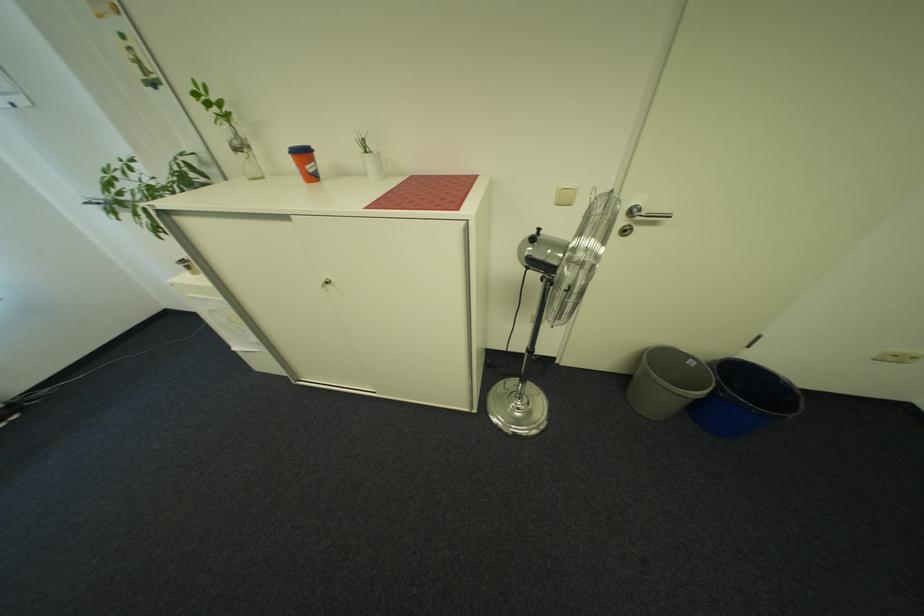
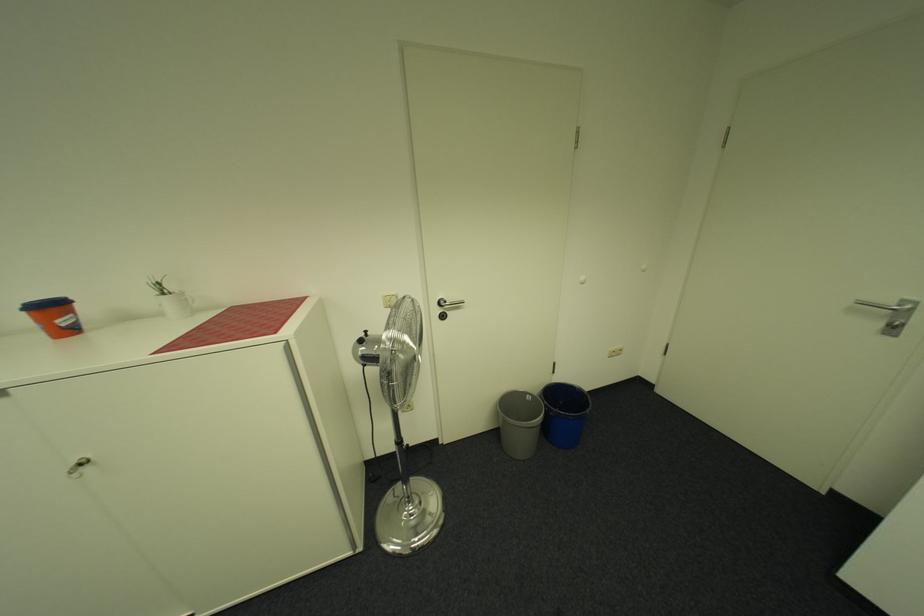
In the second image, find the point that corresponds to pixel 700 361 in the first image.

(538, 397)